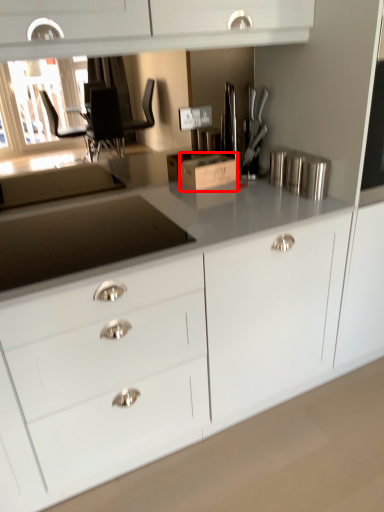
Question: From the image's perspective, what is the correct spatial relationship of cardboard box (annotated by the red box) in relation to appliance?

Choices:
 (A) below
 (B) above

Answer: (B)